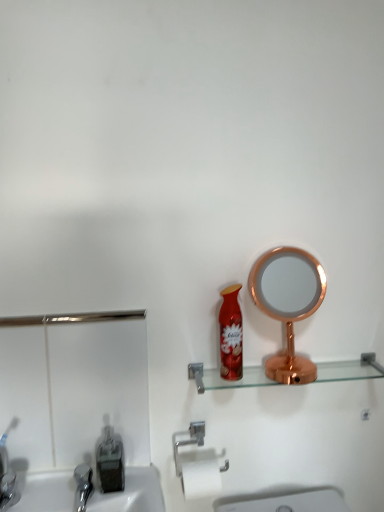
Question: Choose the correct answer: Is brushed metal sink at lower left inside transparent glass shelf at center or outside it?

Choices:
 (A) outside
 (B) inside

Answer: (A)

Question: Relative to transparent glass shelf at center, is brushed metal sink at lower left in front or behind?

Choices:
 (A) front
 (B) behind

Answer: (A)

Question: Considering the real-world distances, which object is farthest from the shiny red spray can at center?

Choices:
 (A) brushed metal sink at lower left
 (B) silver metallic towel bar at lower center
 (C) copper metallic mirror at right
 (D) transparent glass shelf at center
 (E) translucent plastic soap dispenser at lower left

Answer: (E)

Question: Which object is positioned closest to the transparent glass shelf at center?

Choices:
 (A) copper metallic mirror at right
 (B) translucent plastic soap dispenser at lower left
 (C) shiny red spray can at center
 (D) brushed metal sink at lower left
 (E) silver metallic towel bar at lower center

Answer: (C)